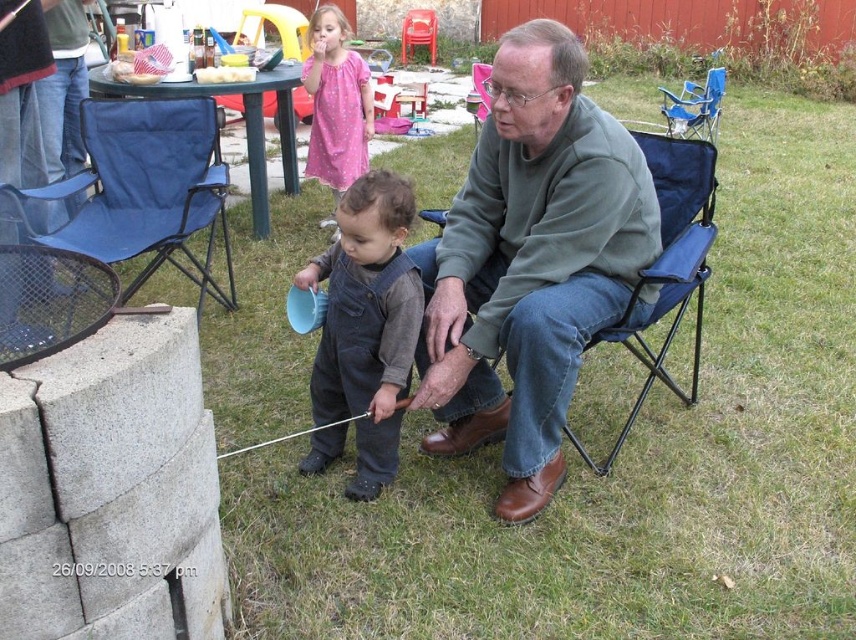
Question: Does denim overalls at center have a lesser width compared to blue fabric chair at left?

Choices:
 (A) no
 (B) yes

Answer: (B)

Question: Is denim overalls at center smaller than blue fabric chair at upper center?

Choices:
 (A) no
 (B) yes

Answer: (B)

Question: Does pink satin dress at upper center appear on the right side of blue fabric chair at upper center?

Choices:
 (A) no
 (B) yes

Answer: (A)

Question: Considering the real-world distances, which object is closest to the pink satin dress at upper center?

Choices:
 (A) blue fabric chair at left
 (B) denim overalls at center
 (C) blue fabric chair at upper center

Answer: (A)

Question: Among these points, which one is farthest from the camera?

Choices:
 (A) (462, 442)
 (B) (721, 68)
 (C) (361, 148)

Answer: (B)

Question: Which point appears farthest from the camera in this image?

Choices:
 (A) (321, 33)
 (B) (704, 109)

Answer: (B)